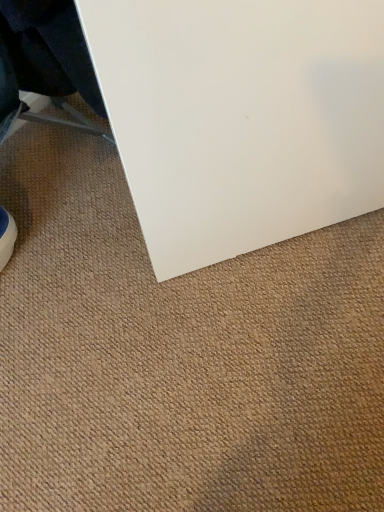
The image size is (384, 512). What do you see at coordinates (44, 59) in the screenshot?
I see `dark blue fabric at lower left` at bounding box center [44, 59].

This screenshot has height=512, width=384. I want to click on dark blue fabric at lower left, so [44, 59].

Where is `dark blue fabric at lower left`? dark blue fabric at lower left is located at coordinates (44, 59).